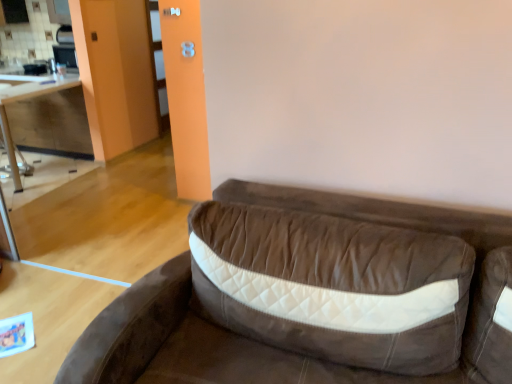
Question: In the image, is brown suede studio couch at center positioned in front of or behind wooden cabinet at left?

Choices:
 (A) behind
 (B) front

Answer: (B)

Question: From the image's perspective, is brown suede studio couch at center located above or below wooden cabinet at left?

Choices:
 (A) above
 (B) below

Answer: (B)

Question: Estimate the real-world distances between objects in this image. Which object is closer to the brown suede studio couch at center?

Choices:
 (A) wooden cabinet at left
 (B) wooden table at left

Answer: (A)

Question: Which of these objects is positioned closest to the brown suede studio couch at center?

Choices:
 (A) wooden table at left
 (B) wooden cabinet at left

Answer: (B)